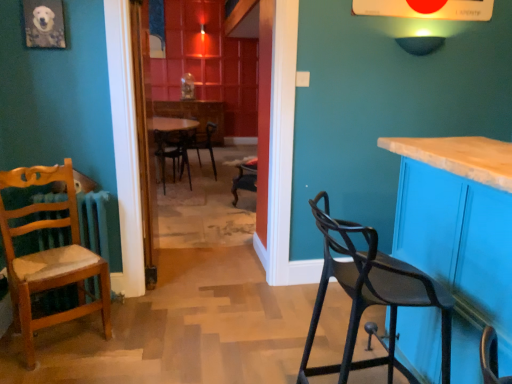
Question: Does black matte chair at center, the third chair when ordered from front to back, have a lesser height compared to black matte bar stool at right, which appears as the fourth chair when viewed from the back?

Choices:
 (A) no
 (B) yes

Answer: (B)

Question: Is black matte chair at center, the third chair when ordered from front to back, positioned beyond the bounds of black matte bar stool at right, the first chair positioned from the right?

Choices:
 (A) yes
 (B) no

Answer: (A)

Question: Is black matte chair at center, the third chair when ordered from front to back, far away from black matte bar stool at right, which is the first chair from front to back?

Choices:
 (A) yes
 (B) no

Answer: (A)

Question: Could you tell me if black matte chair at center, placed as the 2th chair when sorted from back to front, is turned towards black matte bar stool at right, the fourth chair positioned from the left?

Choices:
 (A) no
 (B) yes

Answer: (A)

Question: From the image's perspective, would you say black matte chair at center, arranged as the 3th chair when viewed from the right, is positioned over black matte bar stool at right, which is the first chair from front to back?

Choices:
 (A) yes
 (B) no

Answer: (A)

Question: From the image's perspective, is wooden table at center above or below black matte chair at center, arranged as the 3th chair when viewed from the right?

Choices:
 (A) above
 (B) below

Answer: (B)

Question: Is wooden table at center bigger or smaller than black matte chair at center, arranged as the 3th chair when viewed from the right?

Choices:
 (A) big
 (B) small

Answer: (B)

Question: Visually, is wooden table at center positioned to the left or to the right of black matte chair at center, placed as the 2th chair when sorted from left to right?

Choices:
 (A) right
 (B) left

Answer: (A)

Question: From a real-world perspective, is wooden table at center above or below black matte chair at center, the third chair when ordered from front to back?

Choices:
 (A) below
 (B) above

Answer: (B)

Question: In the image, is wooden chair with cushion at left, the third chair from the back, positioned in front of or behind black matte chair at center, placed as the 2th chair when sorted from left to right?

Choices:
 (A) front
 (B) behind

Answer: (A)

Question: In terms of size, does wooden chair with cushion at left, the third chair from the back, appear bigger or smaller than black matte chair at center, placed as the 2th chair when sorted from left to right?

Choices:
 (A) small
 (B) big

Answer: (A)

Question: Is point (54, 173) positioned closer to the camera than point (184, 145)?

Choices:
 (A) closer
 (B) farther

Answer: (A)

Question: From a real-world perspective, is wooden chair with cushion at left, the third chair from the back, above or below black matte chair at center, placed as the 2th chair when sorted from back to front?

Choices:
 (A) above
 (B) below

Answer: (A)

Question: Is point (323, 370) positioned closer to the camera than point (12, 302)?

Choices:
 (A) closer
 (B) farther

Answer: (A)

Question: Is black matte bar stool at right, the first chair positioned from the right, bigger or smaller than wooden chair with cushion at left, the third chair from the back?

Choices:
 (A) big
 (B) small

Answer: (A)